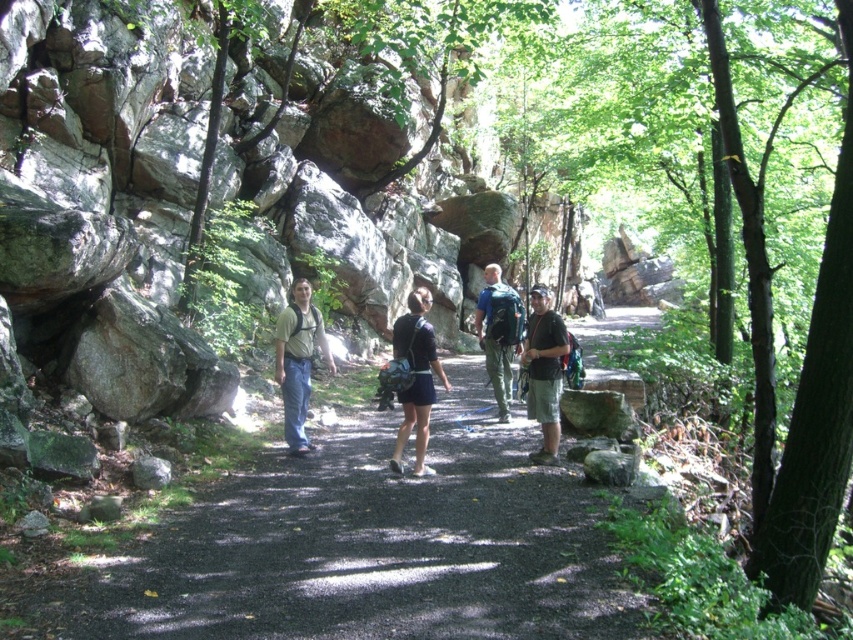
Question: Does black asphalt path at center have a greater width compared to matte khaki shirt at center?

Choices:
 (A) no
 (B) yes

Answer: (B)

Question: Does matte khaki shirt at center come in front of camouflage shorts at center?

Choices:
 (A) yes
 (B) no

Answer: (B)

Question: Based on their relative distances, which object is farther from the black asphalt path at center?

Choices:
 (A) camouflage shorts at center
 (B) matte khaki shirt at center
 (C) matte green backpack at center

Answer: (A)

Question: Which point is closer to the camera?

Choices:
 (A) (326, 358)
 (B) (543, 451)

Answer: (B)

Question: Estimate the real-world distances between objects in this image. Which object is farther from the matte khaki shirt at center?

Choices:
 (A) matte green backpack at center
 (B) camouflage shorts at center

Answer: (B)

Question: Does black asphalt path at center have a larger size compared to camouflage shorts at center?

Choices:
 (A) no
 (B) yes

Answer: (A)